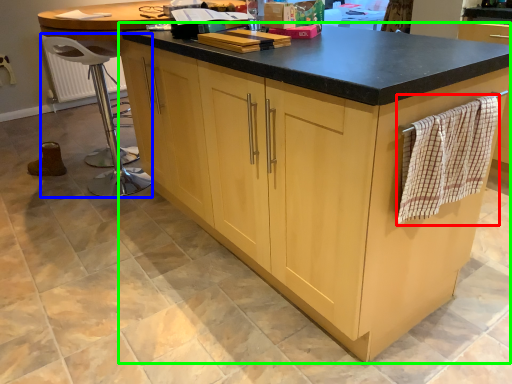
Question: Considering the real-world distances, which object is farthest from blanket (highlighted by a red box)? bar stool (highlighted by a blue box) or cabinetry (highlighted by a green box)?

Choices:
 (A) bar stool
 (B) cabinetry

Answer: (A)